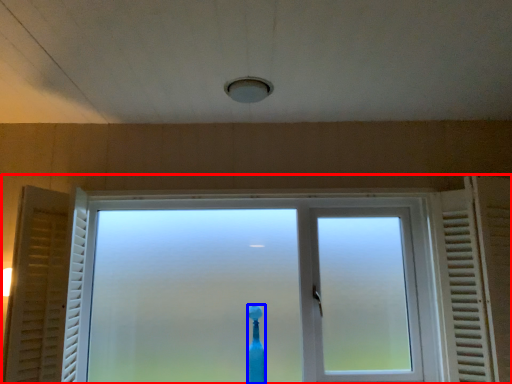
Question: Which point is closer to the camera, window (highlighted by a red box) or toothbrush (highlighted by a blue box)?

Choices:
 (A) window
 (B) toothbrush

Answer: (A)